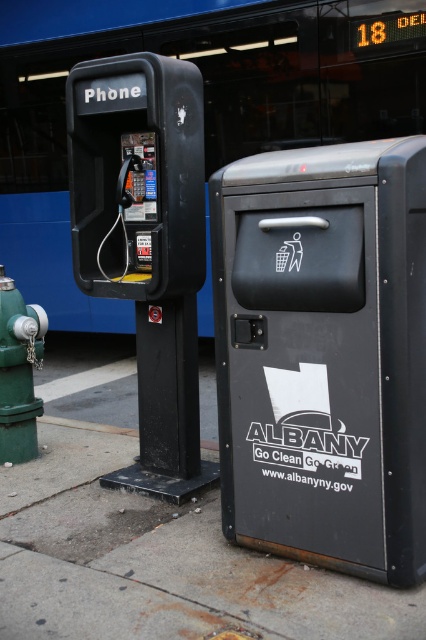
Measure the distance from concrete sidewalk at lower center to green matte hydrant at lower left.

They are 1.39 meters apart.

Does concrete sidewalk at lower center have a greater height compared to green matte hydrant at lower left?

No, concrete sidewalk at lower center is not taller than green matte hydrant at lower left.

Who is more forward, (x=51, y=364) or (x=29, y=369)?

Point (x=29, y=369) is in front.

You are a GUI agent. You are given a task and a screenshot of the screen. Output one action in this format:
    pyautogui.click(x=<x>, y=<y>)
    Task: Click on the concrete sidewalk at lower center
    The width and height of the screenshot is (426, 640).
    Given the screenshot: What is the action you would take?
    pyautogui.click(x=149, y=540)

Who is taller, matte black mailbox at center or concrete sidewalk at lower center?

With more height is matte black mailbox at center.

Which is more to the left, matte black mailbox at center or concrete sidewalk at lower center?

concrete sidewalk at lower center is more to the left.

The height and width of the screenshot is (640, 426). In order to click on matte black mailbox at center in this screenshot , I will do `click(324, 355)`.

Between concrete sidewalk at lower center and matte black phone at left, which one is positioned higher?

matte black phone at left is higher up.

At what (x,y) coordinates should I click in order to perform the action: click on concrete sidewalk at lower center. Please return your answer as a coordinate pair (x, y). The height and width of the screenshot is (640, 426). Looking at the image, I should click on (149, 540).